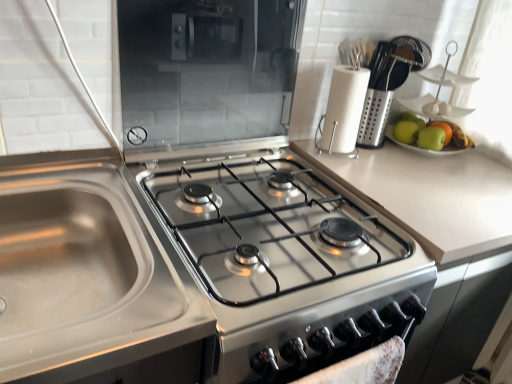
Locate an element on the screen. The width and height of the screenshot is (512, 384). vacant area that lies to the right of green matte apple at upper right, which appears as the second apple when viewed from the left is located at coordinates (474, 162).